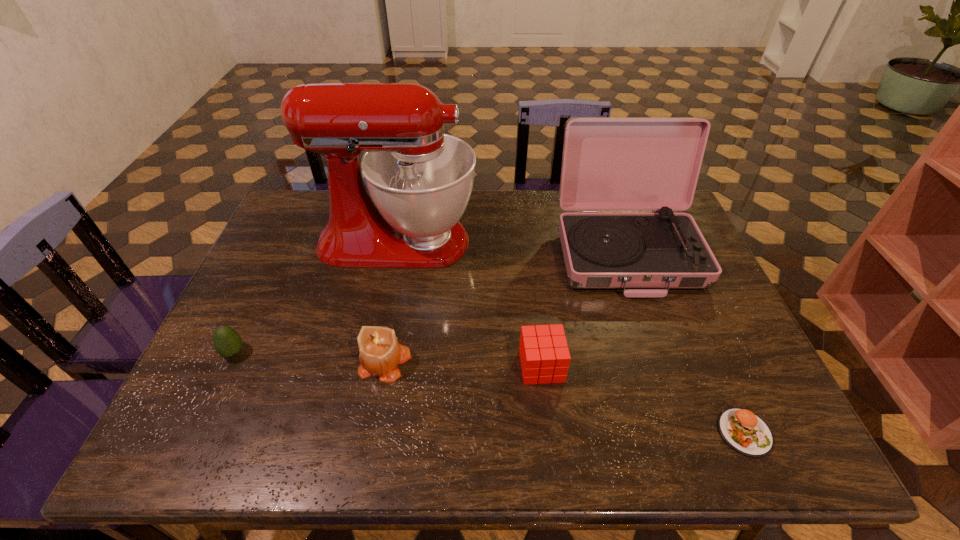
I want to click on mixer, so tap(419, 180).

Identify the location of record player. (609, 164).

I want to click on the fourth shortest object, so click(x=380, y=354).

This screenshot has width=960, height=540. I want to click on the fourth object from left to right, so click(x=544, y=355).

Find the location of `the leftmost object`. the leftmost object is located at coordinates pyautogui.click(x=227, y=342).

At what (x,y) coordinates should I click in order to perform the action: click on the nearest object. Please return your answer as a coordinate pair (x, y). Looking at the image, I should click on (745, 432).

I want to click on patty, so click(x=745, y=432).

What are the coordinates of `free space located 0.100m at the attachment hub of the mixer` in the screenshot? It's located at (509, 241).

At what (x,y) coordinates should I click in order to perform the action: click on free space located 0.110m with the lid open on the record player. Please return your answer as a coordinate pair (x, y). The height and width of the screenshot is (540, 960). Looking at the image, I should click on (655, 333).

The image size is (960, 540). Find the location of `vacant space located on the front of the fourth shortest object`. vacant space located on the front of the fourth shortest object is located at coordinates (371, 447).